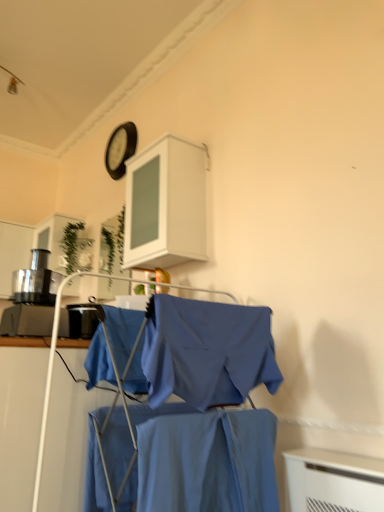
Question: From the image's perspective, is green matte plant at upper center, which is counted as the second plant, starting from the right, located beneath green glass plant at upper center, which is the 1th plant in right-to-left order?

Choices:
 (A) no
 (B) yes

Answer: (A)

Question: Is green matte plant at upper center, arranged as the first plant when viewed from the left, far away from green glass plant at upper center, which is counted as the second plant, starting from the left?

Choices:
 (A) yes
 (B) no

Answer: (B)

Question: Considering the relative sizes of green matte plant at upper center, which is counted as the second plant, starting from the right, and green glass plant at upper center, which is counted as the second plant, starting from the left, in the image provided, is green matte plant at upper center, which is counted as the second plant, starting from the right, bigger than green glass plant at upper center, which is counted as the second plant, starting from the left,?

Choices:
 (A) no
 (B) yes

Answer: (B)

Question: Is green glass plant at upper center, which is counted as the second plant, starting from the left, at the back of green matte plant at upper center, arranged as the first plant when viewed from the left?

Choices:
 (A) yes
 (B) no

Answer: (B)

Question: Is green matte plant at upper center, which is counted as the second plant, starting from the right, facing towards green glass plant at upper center, which is the 1th plant in right-to-left order?

Choices:
 (A) no
 (B) yes

Answer: (A)

Question: Is green matte plant at upper center, which is counted as the second plant, starting from the right, closer to camera compared to green glass plant at upper center, which is counted as the second plant, starting from the left?

Choices:
 (A) no
 (B) yes

Answer: (A)

Question: From a real-world perspective, is blue fabric shirt at center below blue cotton shirt at center, which is the first fabric from back to front?

Choices:
 (A) yes
 (B) no

Answer: (A)

Question: Does blue fabric shirt at center appear on the left side of blue cotton shirt at center, which is the first fabric from back to front?

Choices:
 (A) yes
 (B) no

Answer: (B)

Question: Is blue fabric shirt at center wider than blue cotton shirt at center, the 2th fabric when ordered from right to left?

Choices:
 (A) yes
 (B) no

Answer: (A)

Question: Does blue fabric shirt at center turn towards blue cotton shirt at center, the second fabric from the front?

Choices:
 (A) no
 (B) yes

Answer: (A)

Question: From the image's perspective, would you say blue fabric shirt at center is positioned over blue cotton shirt at center, the 2th fabric when ordered from right to left?

Choices:
 (A) no
 (B) yes

Answer: (B)

Question: Can you see blue fabric shirt at center touching blue cotton shirt at center, the 2th fabric when ordered from right to left?

Choices:
 (A) no
 (B) yes

Answer: (A)

Question: From a real-world perspective, is white matte cabinet at upper center on top of blue fabric shirt at center?

Choices:
 (A) yes
 (B) no

Answer: (A)